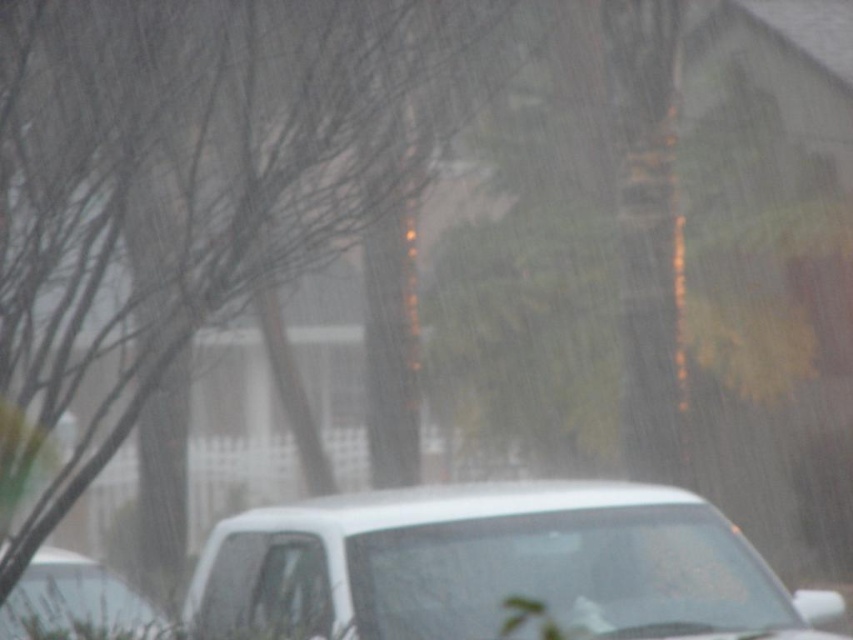
Between white matte car at lower center and white matte car at lower left, which one has less height?

white matte car at lower left

Who is higher up, white matte car at lower center or white matte car at lower left?

white matte car at lower left

Who is more forward, (674, 531) or (49, 616)?

Point (49, 616) is in front.

Find the location of a particular element. This screenshot has width=853, height=640. white matte car at lower center is located at coordinates (495, 566).